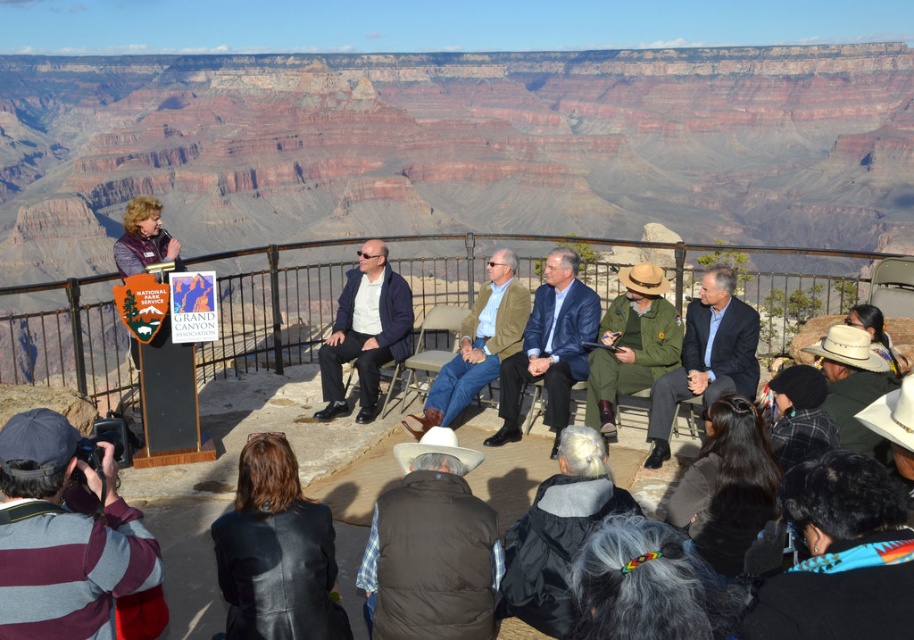
Question: Among these points, which one is farthest from the camera?

Choices:
 (A) (437, 545)
 (B) (113, 592)
 (C) (506, 250)

Answer: (C)

Question: Estimate the real-world distances between objects in this image. Which object is farther from the matte white shirt at center?

Choices:
 (A) brown puffy vest at lower center
 (B) green uniform at center
 (C) blue fabric suit at center

Answer: (A)

Question: Does matte white shirt at center have a smaller size compared to light brown leather jacket at center?

Choices:
 (A) yes
 (B) no

Answer: (A)

Question: Can you confirm if brown puffy vest at lower center is bigger than green uniform at center?

Choices:
 (A) no
 (B) yes

Answer: (A)

Question: Which is nearer to the blue fabric suit at center?

Choices:
 (A) matte white shirt at center
 (B) light brown leather jacket at center

Answer: (B)

Question: In this image, where is striped fabric camera at lower left located relative to blue fabric suit at center?

Choices:
 (A) above
 (B) below

Answer: (B)